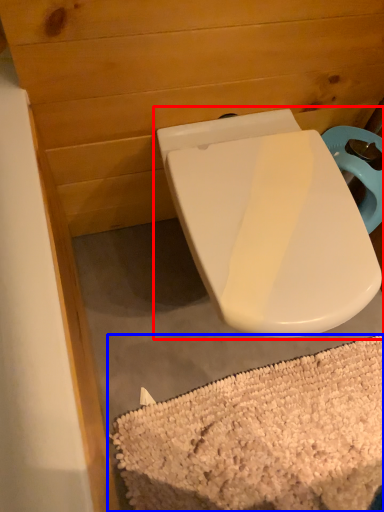
Question: Which of the following is the farthest to the observer, toilet (highlighted by a red box) or bath mat (highlighted by a blue box)?

Choices:
 (A) toilet
 (B) bath mat

Answer: (B)